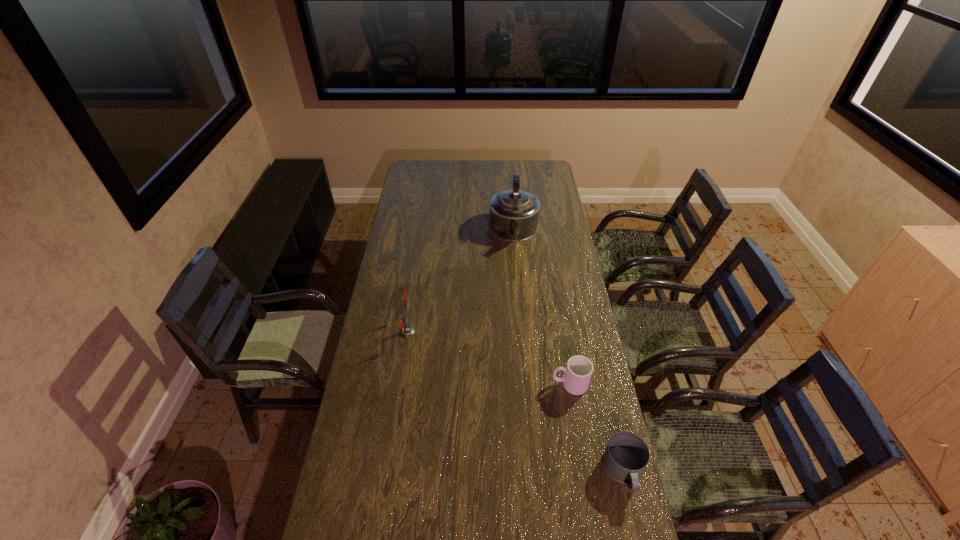
Where is `free space between the third shortest object and the second nearest object`? free space between the third shortest object and the second nearest object is located at coordinates (488, 358).

Find the location of a particular element. free space between the second nearest object and the farthest object is located at coordinates (541, 308).

Where is `free area in between the nearest object and the second farthest object`? free area in between the nearest object and the second farthest object is located at coordinates (516, 401).

Locate an element on the screen. empty location between the second shortest object and the third shortest object is located at coordinates (488, 358).

Point out which object is positioned as the third nearest to the nearest object. Please provide its 2D coordinates. Your answer should be formatted as a tuple, i.e. [(x, y)], where the tuple contains the x and y coordinates of a point satisfying the conditions above.

[(513, 214)]

Point out which object is positioned as the nearest to the third farthest object. Please provide its 2D coordinates. Your answer should be formatted as a tuple, i.e. [(x, y)], where the tuple contains the x and y coordinates of a point satisfying the conditions above.

[(626, 456)]